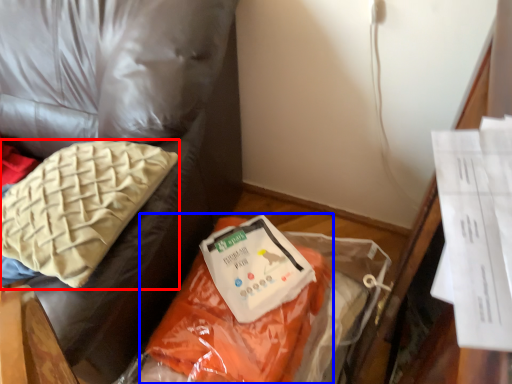
Question: Which of the following is the closest to the observer, pillow (highlighted by a red box) or stuff (highlighted by a blue box)?

Choices:
 (A) pillow
 (B) stuff

Answer: (A)